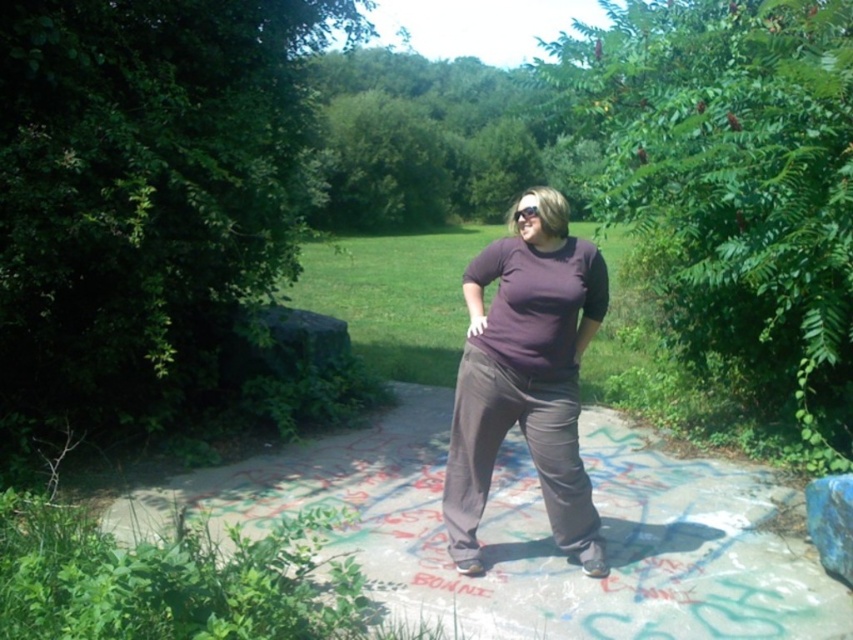
You are a photographer trying to capture the purple matte shirt at center and the concrete sidewalk at center in a single shot. Based on their positions, can you tell which object is closer to the camera?

The concrete sidewalk at center is below the purple matte shirt at center, so the purple matte shirt at center is closer to the camera than the concrete sidewalk at center.

You are a photographer trying to capture the purple matte shirt at center while avoiding the concrete sidewalk at center in the background. Is the sidewalk behind or in front of the shirt?

The concrete sidewalk at center is in front of the purple matte shirt at center, so the sidewalk would block the background view of the shirt.

You are a photographer trying to capture a closeup shot of the purple matte shirt at center while standing on the concrete sidewalk at center. Can you reach the shirt without moving your feet?

The concrete sidewalk at center and purple matte shirt at center are 18.91 inches apart. Since 18.91 inches is approximately 1.58 feet, it is likely reachable by stretching your arm out, so yes, you can reach the purple matte shirt at center without moving your feet.